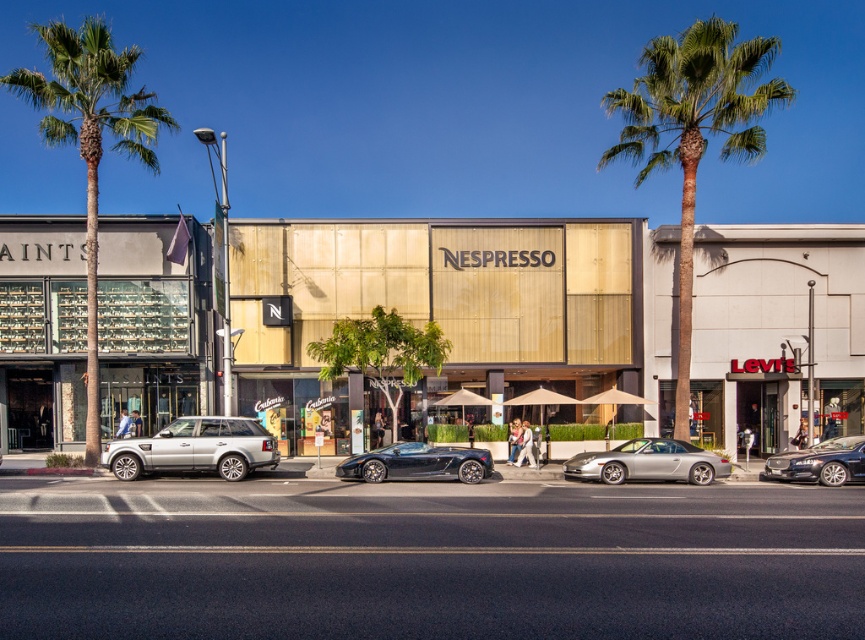
You are standing at the entrance of the NESPRESSO building and want to hail a taxi. There is a silver metallic suv at center blocking your view of the road. Can you see the road clearly from your current position?

The silver metallic suv at center is located at point (195, 449), which might be blocking your view of the road. Since the suv is positioned centrally, it could obstruct the line of sight, making it difficult to see the road clearly from the entrance.

You are a delivery person needing to park your van next to the silver metallic suv at center and the silver metallic convertible at center. Which vehicle should you park next to if you want to maximize the remaining space for other cars?

The silver metallic suv at center is larger in size than the silver metallic convertible at center, so you should park next to the smaller silver metallic convertible at center to leave more space for other cars.

You are standing on the sidewalk in front of the NESPRESSO building and see the silver metallic suv at center and the silver metallic convertible at center. Which vehicle is closer to you?

The silver metallic suv at center is closer to the viewer than the silver metallic convertible at center.